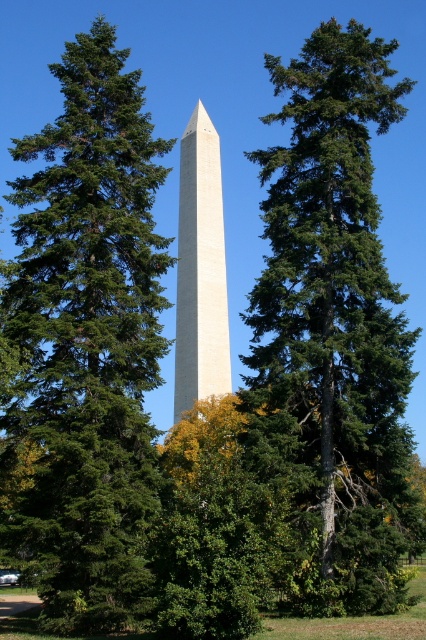
You are a landscape architect planning to add a new pathway around the green evergreen tree at center and the white marble obelisk at center. Which object requires a larger pathway to accommodate its size?

The green evergreen tree at center requires a larger pathway because it is larger in size than the white marble obelisk at center according to the description.

You are a photographer aiming to capture the white marble obelisk at center without any obstructions. Given that you can only move forward or backward, which direction should you move to ensure the green textured tree at center is no longer blocking the view?

The green textured tree at center is currently in front of the white marble obelisk at center. To remove the obstruction, you should move backward to create more distance between yourself and the tree, allowing the obelisk to become visible behind the tree.

You are standing in front of the monument and want to take a photo that includes both the green evergreen tree at center and the white marble obelisk at center. Which object should you position closer to the front of your photo to ensure both are in frame?

You should position the green evergreen tree at center closer to the front of your photo because it is closer to the viewer than the white marble obelisk at center, ensuring both are visible in the frame.